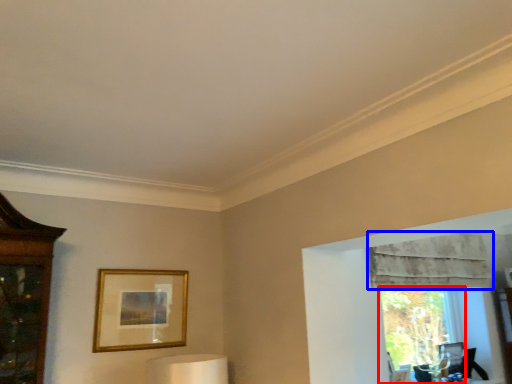
Question: Which of the following is the farthest to the observer, window (highlighted by a red box) or curtain (highlighted by a blue box)?

Choices:
 (A) window
 (B) curtain

Answer: (A)